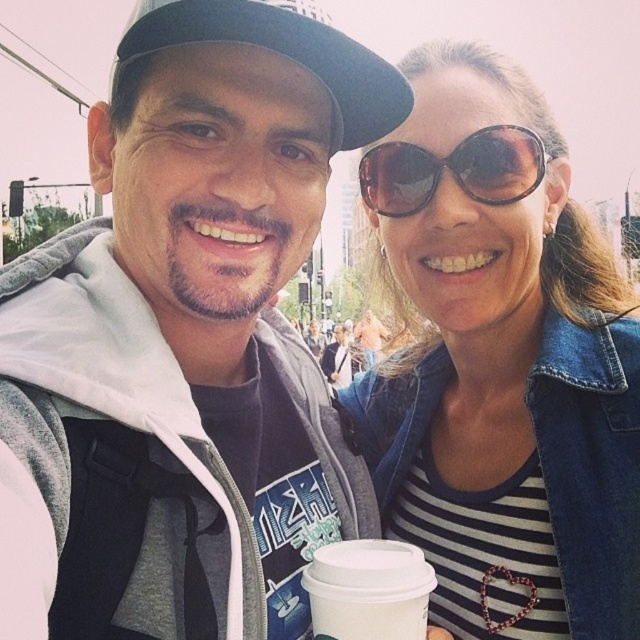
Who is taller, matte gray hoodie at center or black fabric baseball cap at upper left?

matte gray hoodie at center

Does matte gray hoodie at center appear over black fabric baseball cap at upper left?

No.

Describe the element at coordinates (184, 340) in the screenshot. I see `matte gray hoodie at center` at that location.

Identify the location of matte gray hoodie at center. (184, 340).

Which is above, black fabric baseball cap at upper left or sunglasses at center?

black fabric baseball cap at upper left is above.

Describe the element at coordinates (280, 52) in the screenshot. I see `black fabric baseball cap at upper left` at that location.

The image size is (640, 640). What are the coordinates of `black fabric baseball cap at upper left` in the screenshot? It's located at (280, 52).

Which is more to the right, white paper cup at center or sunglasses at center?

Positioned to the right is sunglasses at center.

Is white paper cup at center below sunglasses at center?

Yes.

Does point (385, 563) lie in front of point (515, 136)?

Yes, point (385, 563) is closer to viewer.

This screenshot has height=640, width=640. I want to click on white paper cup at center, so click(x=369, y=589).